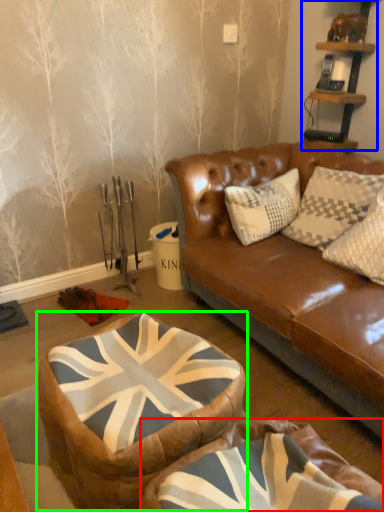
Question: Based on their relative distances, which object is farther from bean bag chair (highlighted by a red box)? Choose from shelf (highlighted by a blue box) and bean bag chair (highlighted by a green box).

Choices:
 (A) shelf
 (B) bean bag chair

Answer: (A)